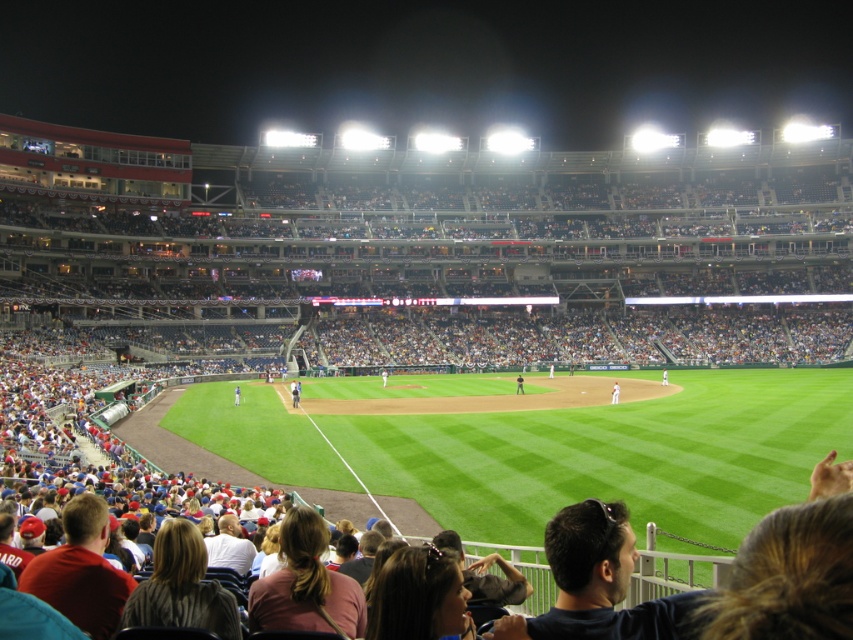
You are a photographer standing at the edge of the field. You want to take a photo that includes both the white jersey at center and the blue uniformed player at center. What is the minimum distance you need to move backward to ensure both are fully visible in your camera frame?

The white jersey at center and blue uniformed player at center are 4.45 meters apart. To capture both in the frame, you need to move back at least 4.45 meters to ensure the entire distance between them fits within the camera view.

You are a photographer at the baseball game and want to take a photo of both the white uniformed player at center and the white uniformed person at center. Which one will appear bigger in your photo?

The white uniformed player at center will appear bigger in the photo because it is larger in size than the white uniformed person at center.